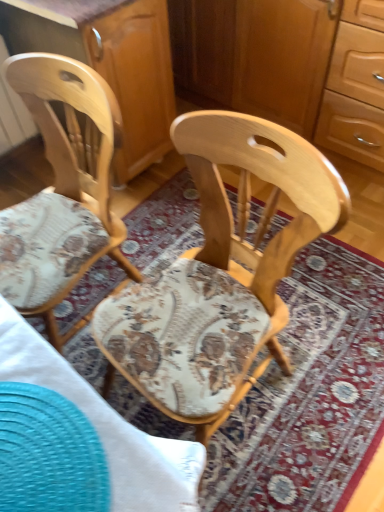
Question: Considering the positions of natural wood chair at left, placed as the second chair when sorted from right to left, and wooden dresser at center in the image, is natural wood chair at left, placed as the second chair when sorted from right to left, taller or shorter than wooden dresser at center?

Choices:
 (A) tall
 (B) short

Answer: (A)

Question: From the image's perspective, is natural wood chair at left, placed as the second chair when sorted from right to left, positioned above or below wooden dresser at center?

Choices:
 (A) above
 (B) below

Answer: (B)

Question: Which object is the farthest from the wooden cabinet at center?

Choices:
 (A) smooth teal placemat at lower left
 (B) natural wood chair at center, which is counted as the 1th chair, starting from the right
 (C) wooden dresser at center
 (D) natural wood chair at left, placed as the second chair when sorted from right to left

Answer: (A)

Question: Estimate the real-world distances between objects in this image. Which object is farther from the wooden cabinet at center?

Choices:
 (A) smooth teal placemat at lower left
 (B) natural wood chair at center, which is counted as the 1th chair, starting from the right
 (C) natural wood chair at left, arranged as the 1th chair when viewed from the left
 (D) wooden dresser at center

Answer: (A)